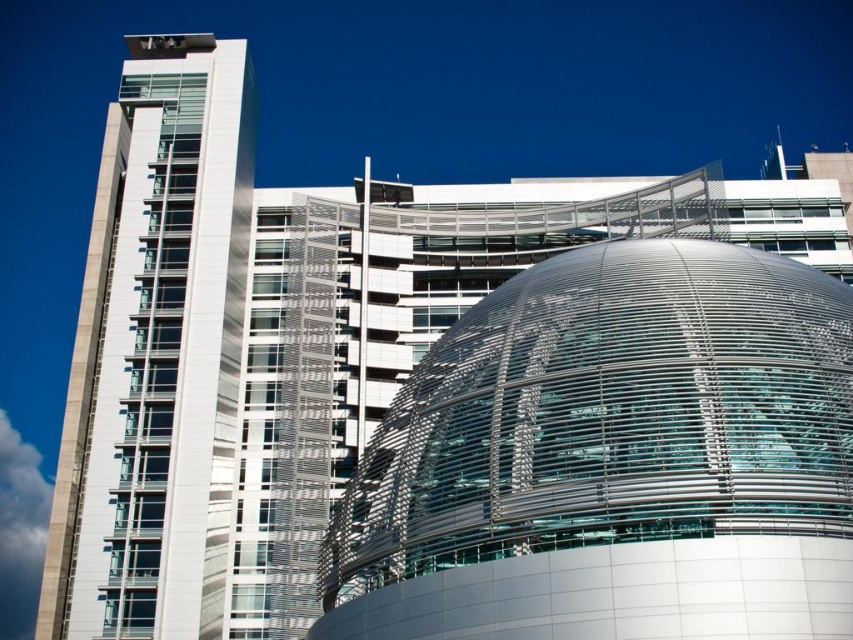
Is transparent glass dome at center behind white glass building at left?

That is False.

Can you confirm if transparent glass dome at center is wider than white glass building at left?

No.

Who is more forward, (816, 420) or (199, 196)?

Point (816, 420) is more forward.

At what (x,y) coordinates should I click in order to perform the action: click on transparent glass dome at center. Please return your answer as a coordinate pair (x, y). Looking at the image, I should click on (612, 458).